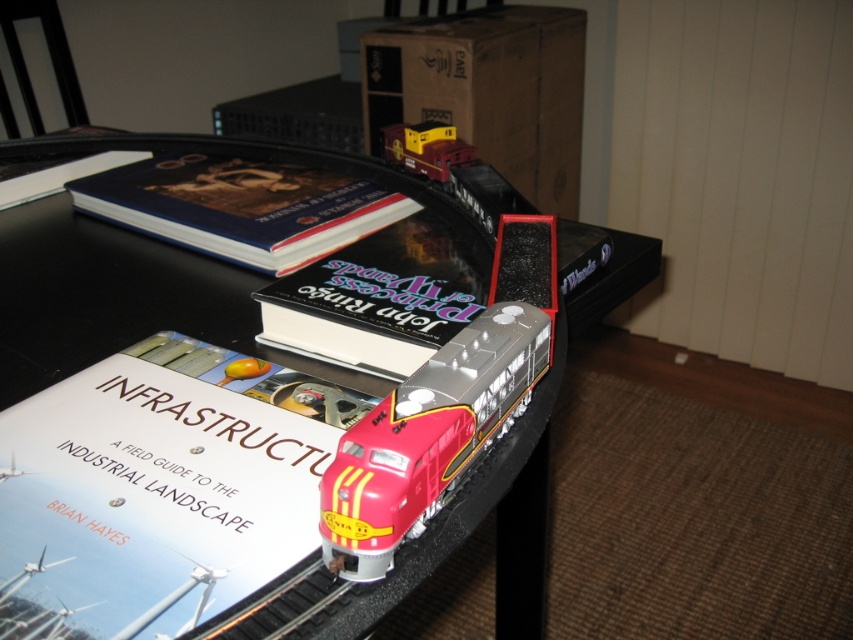
Question: Based on their relative distances, which object is farther from the hardcover book at upper left?

Choices:
 (A) white paper book at center
 (B) black plastic table at center
 (C) hardcover book at upper center
 (D) hardcover book at center

Answer: (A)

Question: Is black plastic table at center bigger than hardcover book at upper left?

Choices:
 (A) no
 (B) yes

Answer: (B)

Question: Which of the following is the farthest from the observer?

Choices:
 (A) (252, 192)
 (B) (96, 252)
 (C) (427, 456)

Answer: (A)

Question: Does black plastic table at center appear on the right side of matte red train at center?

Choices:
 (A) no
 (B) yes

Answer: (A)

Question: Among these objects, which one is farthest from the camera?

Choices:
 (A) shiny plastic train at center
 (B) black plastic table at center

Answer: (A)

Question: Does white paper book at center appear over hardcover book at upper left?

Choices:
 (A) yes
 (B) no

Answer: (B)